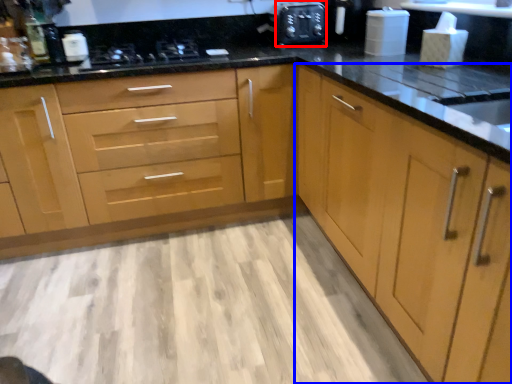
Question: Which object is further to the camera taking this photo, appliance (highlighted by a red box) or cabinetry (highlighted by a blue box)?

Choices:
 (A) appliance
 (B) cabinetry

Answer: (A)